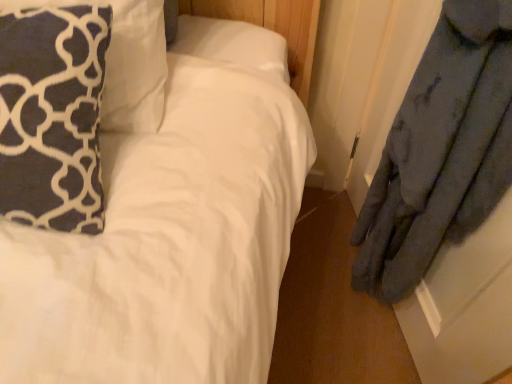
Question: From a real-world perspective, is dark blue plush pillow at upper left, arranged as the 2th pillow when viewed from the top, above or below dark blue fabric pillow at upper left, the first pillow in the top-to-bottom sequence?

Choices:
 (A) above
 (B) below

Answer: (A)

Question: Looking at their shapes, would you say dark blue plush pillow at upper left, arranged as the 2th pillow when viewed from the top, is wider or thinner than dark blue fabric pillow at upper left, arranged as the second pillow when ordered from the bottom?

Choices:
 (A) thin
 (B) wide

Answer: (B)

Question: From their relative heights in the image, would you say dark blue plush pillow at upper left, which is counted as the first pillow, starting from the bottom, is taller or shorter than dark blue fabric pillow at upper left, the first pillow in the top-to-bottom sequence?

Choices:
 (A) tall
 (B) short

Answer: (B)

Question: From the image's perspective, is dark blue fabric pillow at upper left, arranged as the second pillow when ordered from the bottom, positioned above or below dark blue plush pillow at upper left, arranged as the 2th pillow when viewed from the top?

Choices:
 (A) above
 (B) below

Answer: (A)

Question: From a real-world perspective, is dark blue fabric pillow at upper left, arranged as the second pillow when ordered from the bottom, physically located above or below dark blue plush pillow at upper left, which is counted as the first pillow, starting from the bottom?

Choices:
 (A) above
 (B) below

Answer: (B)

Question: Considering the positions of dark blue fabric pillow at upper left, arranged as the second pillow when ordered from the bottom, and dark blue plush pillow at upper left, which is counted as the first pillow, starting from the bottom, in the image, is dark blue fabric pillow at upper left, arranged as the second pillow when ordered from the bottom, bigger or smaller than dark blue plush pillow at upper left, which is counted as the first pillow, starting from the bottom,?

Choices:
 (A) big
 (B) small

Answer: (A)

Question: Choose the correct answer: Is dark blue fabric pillow at upper left, the first pillow in the top-to-bottom sequence, inside dark blue plush pillow at upper left, which is counted as the first pillow, starting from the bottom, or outside it?

Choices:
 (A) outside
 (B) inside

Answer: (A)